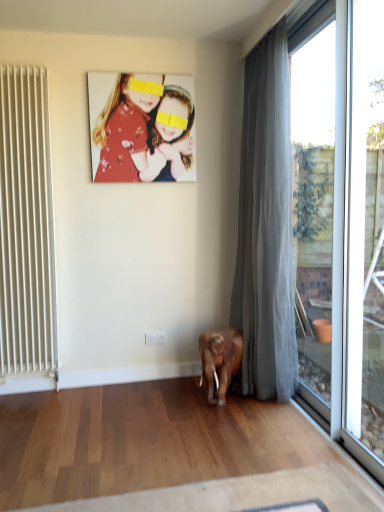
Question: From a real-world perspective, is white plastic window frame at right, which is the first window frame from front to back, physically above white matte radiator at left?

Choices:
 (A) no
 (B) yes

Answer: (A)

Question: Is white plastic window frame at right, which appears as the 2th window frame when viewed from the back, aimed at white matte radiator at left?

Choices:
 (A) no
 (B) yes

Answer: (A)

Question: Is white plastic window frame at right, which appears as the 2th window frame when viewed from the back, bigger than white matte radiator at left?

Choices:
 (A) yes
 (B) no

Answer: (B)

Question: Would you say white matte radiator at left is part of white plastic window frame at right, which is the first window frame from front to back,'s contents?

Choices:
 (A) yes
 (B) no

Answer: (B)

Question: Are white plastic window frame at right, which is the first window frame from front to back, and white matte radiator at left located far from each other?

Choices:
 (A) yes
 (B) no

Answer: (A)

Question: Is white plastic window frame at right, which is the first window frame from front to back, shorter than white matte radiator at left?

Choices:
 (A) no
 (B) yes

Answer: (A)

Question: Is white plastic power outlet at lower center not within white matte radiator at left?

Choices:
 (A) yes
 (B) no

Answer: (A)

Question: Is white plastic power outlet at lower center to the left of white matte radiator at left from the viewer's perspective?

Choices:
 (A) yes
 (B) no

Answer: (B)

Question: From a real-world perspective, does white plastic power outlet at lower center sit lower than white matte radiator at left?

Choices:
 (A) no
 (B) yes

Answer: (B)

Question: Is white plastic power outlet at lower center taller than white matte radiator at left?

Choices:
 (A) yes
 (B) no

Answer: (B)

Question: Could you tell me if white plastic power outlet at lower center is turned towards white matte radiator at left?

Choices:
 (A) no
 (B) yes

Answer: (A)

Question: Does white plastic power outlet at lower center have a lesser height compared to white matte radiator at left?

Choices:
 (A) yes
 (B) no

Answer: (A)

Question: Does gray sheer curtain at right have a smaller size compared to white matte radiator at left?

Choices:
 (A) yes
 (B) no

Answer: (B)